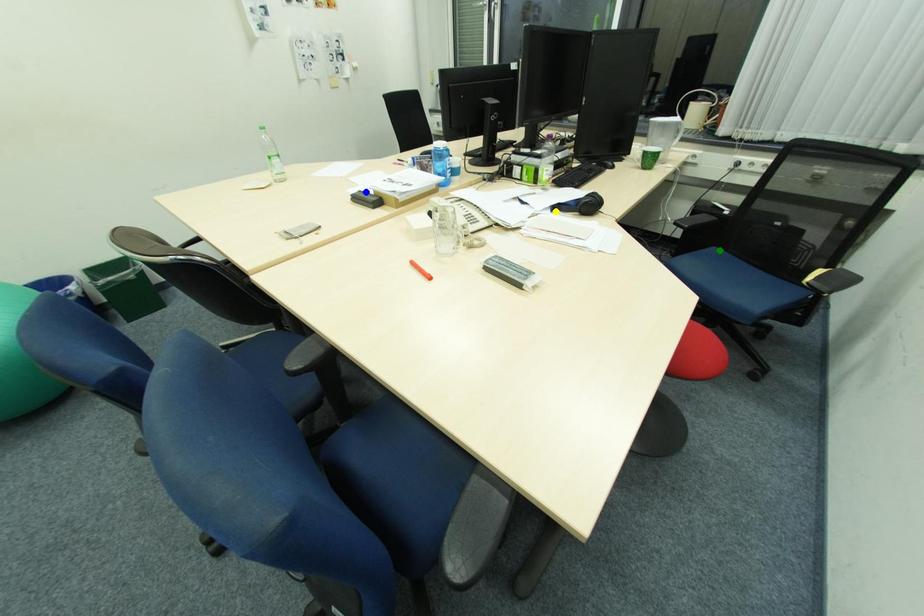
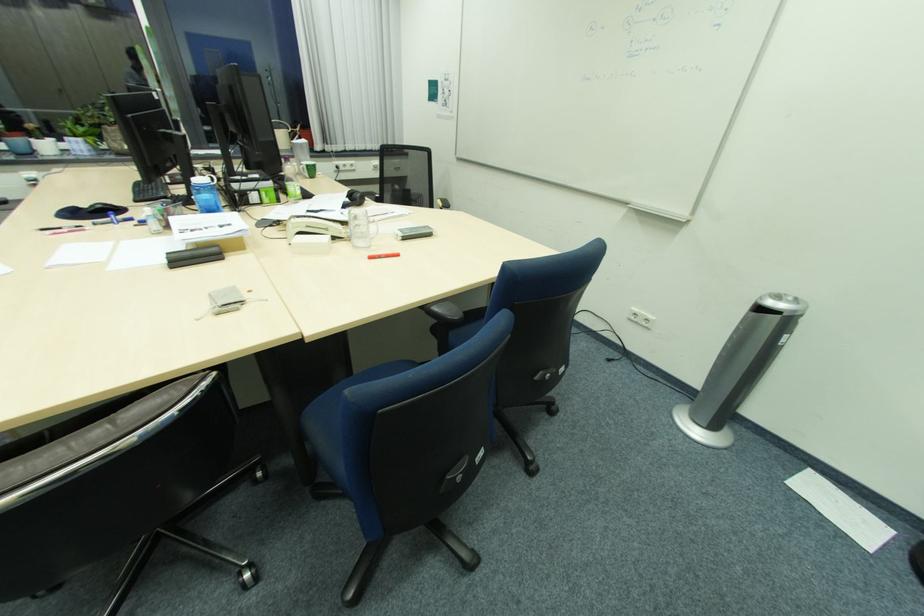
I am providing you with two images of the same scene from different viewpoints. Three points are marked in image1. Which point corresponds to a part or object that is occluded in image2?In image1, three points are marked. Which of them correspond to a part or object that is occluded in image2?Among the three points shown in image1, which one corresponds to a part or object that is no longer visible due to occlusion in image2?

Invisible in image2: green point.